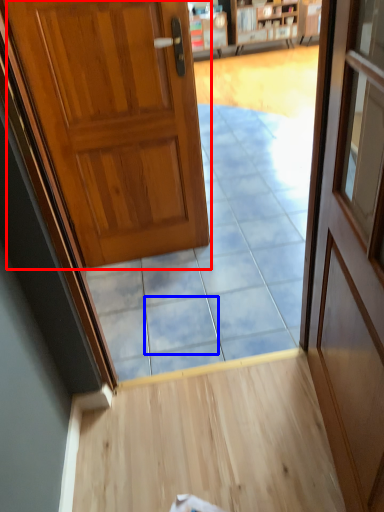
Question: Which point is closer to the camera, door (highlighted by a red box) or tile (highlighted by a blue box)?

Choices:
 (A) door
 (B) tile

Answer: (A)